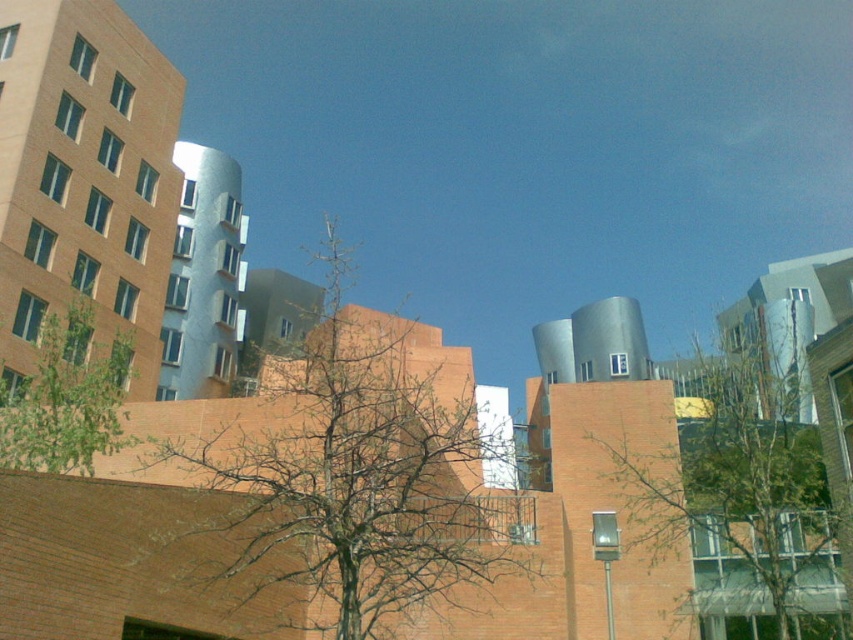
You are an urban planner analyzing the space between the bare branches at center and the green leafy tree at center. Which one occupies more area in the scene?

The bare branches at center is larger in size than the green leafy tree at center, so it occupies more area in the scene.

Consider the image. You are a landscape architect planning to plant a new tree between the bare branches at center and the green leafy tree at center. The new tree requires a minimum of 20 meters of space between it and any existing trees. Based on the current spacing between the existing trees, is this feasible?

The bare branches at center and green leafy tree at center are 19.68 meters apart from each other. Since the new tree requires a minimum of 20 meters of space between it and any existing trees, the current spacing is insufficient. Therefore, planting the new tree between them would not be feasible as the existing trees are only 19.68 meters apart, which is less than the required 20 meters.